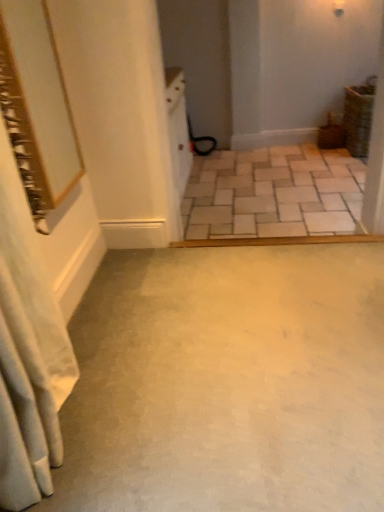
Image resolution: width=384 pixels, height=512 pixels. Identify the location of vacant area that is situated to the right of white fabric shower curtain at left. (167, 420).